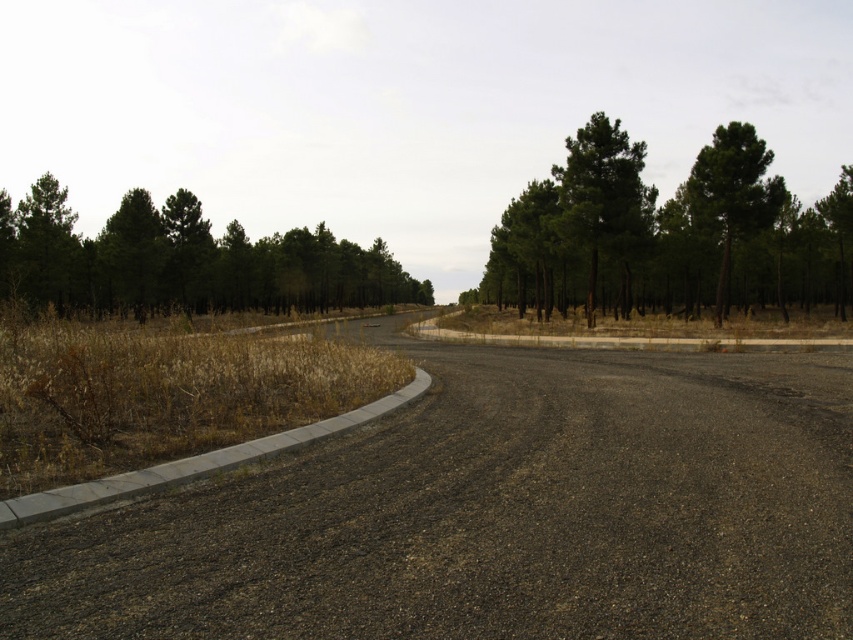
Is green matte trees at upper left to the right of green matte tree at left from the viewer's perspective?

Indeed, green matte trees at upper left is positioned on the right side of green matte tree at left.

Which of these two, green matte trees at upper left or green matte tree at left, stands shorter?

With less height is green matte trees at upper left.

You are a GUI agent. You are given a task and a screenshot of the screen. Output one action in this format:
    pyautogui.click(x=<x>, y=<y>)
    Task: Click on the green matte trees at upper left
    This screenshot has height=640, width=853.
    Given the screenshot: What is the action you would take?
    pyautogui.click(x=184, y=260)

Is point (701, 161) behind point (137, 268)?

No, it is not.

Does green matte trees at upper center have a larger size compared to green matte trees at upper left?

Correct, green matte trees at upper center is larger in size than green matte trees at upper left.

Describe the element at coordinates (668, 234) in the screenshot. I see `green matte trees at upper center` at that location.

I want to click on green matte trees at upper center, so click(668, 234).

Is green rough bark tree at center positioned behind green leafy tree at upper right?

Yes, it is.

Does green rough bark tree at center have a greater height compared to green leafy tree at upper right?

Yes, green rough bark tree at center is taller than green leafy tree at upper right.

Who is more distant from viewer, (585, 128) or (717, 316)?

The point (585, 128) is behind.

Where is `green rough bark tree at center`? green rough bark tree at center is located at coordinates (602, 195).